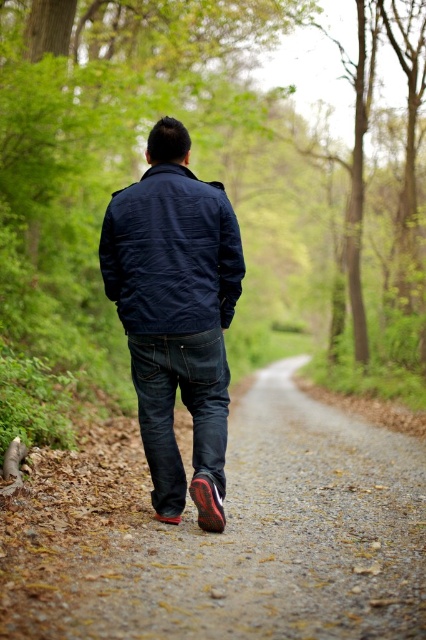
Who is more distant from viewer, (101, 152) or (78, 609)?

Positioned behind is point (101, 152).

Can you confirm if green matte forest at center is smaller than dirt/gravel path at center?

Actually, green matte forest at center might be larger than dirt/gravel path at center.

Find the location of a particular element. This screenshot has width=426, height=640. green matte forest at center is located at coordinates (203, 177).

What are the coordinates of `green matte forest at center` in the screenshot? It's located at (203, 177).

Which is in front, point (226, 556) or point (219, 460)?

Point (226, 556) is more forward.

Is point (178, 582) positioned after point (221, 372)?

No, it is not.

At what (x,y) coordinates should I click in order to perform the action: click on dirt/gravel path at center. Please return your answer as a coordinate pair (x, y). The height and width of the screenshot is (640, 426). Looking at the image, I should click on (224, 532).

Does navy fabric jacket at center lie in front of dark blue denim jeans at center?

That is True.

Which of these two, navy fabric jacket at center or dark blue denim jeans at center, stands taller?

Standing taller between the two is dark blue denim jeans at center.

At what (x,y) coordinates should I click in order to perform the action: click on navy fabric jacket at center. Please return your answer as a coordinate pair (x, y). The image size is (426, 640). Looking at the image, I should click on (172, 253).